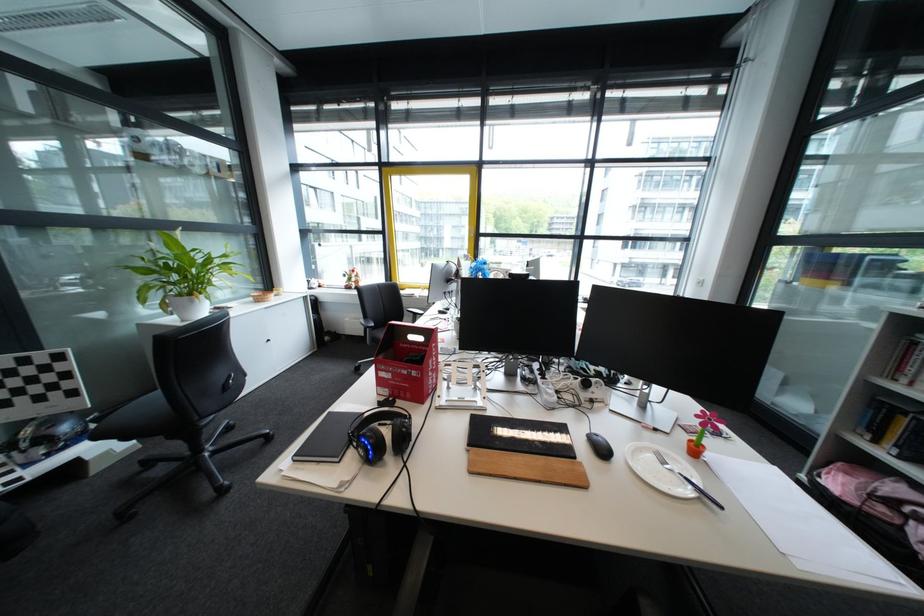
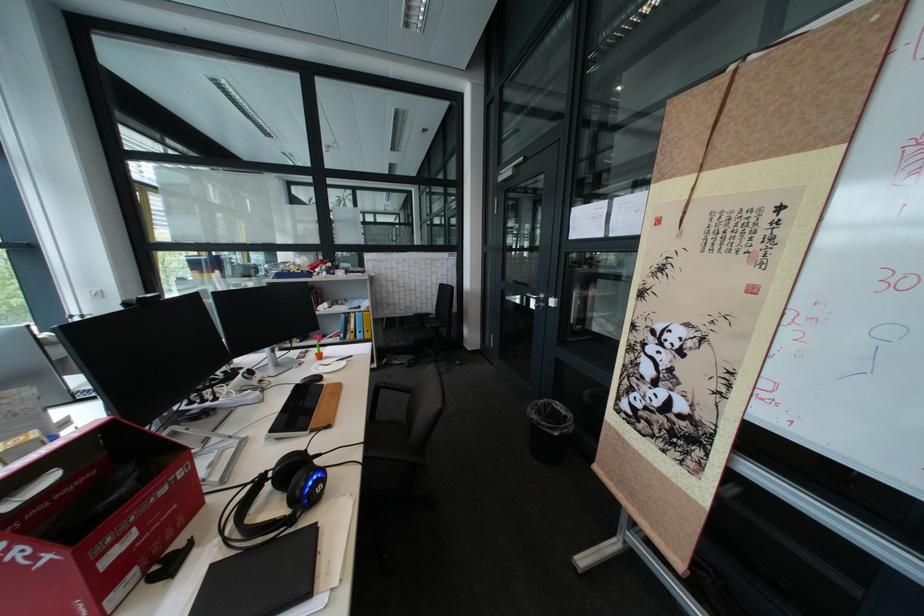
Where in the second image is the point corresponding to the point at 378,440 from the first image?

(323, 485)